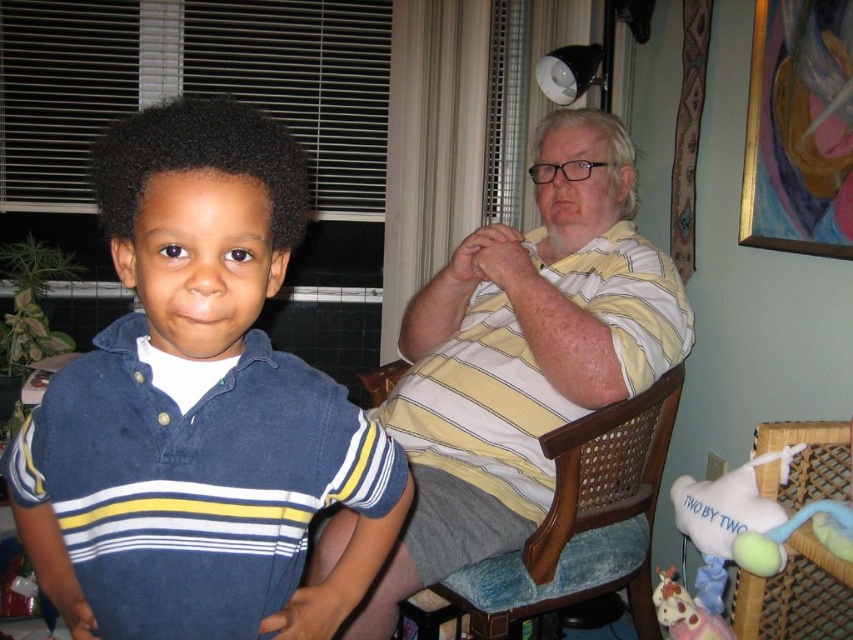
You are a photographer setting up for a family portrait. You notice the matte blue shirt at left and the white plush toy at lower right. To ensure both are clearly visible in the shot, which object should you focus on first?

The matte blue shirt at left is in front of the white plush toy at lower right, so you should focus on the matte blue shirt at left first to ensure both are in clear view.

You are standing in the room and want to determine which of the two points, point (x=602, y=467) or point (x=747, y=492), is closer to you. Based on the image, which point is nearer?

Point (x=602, y=467) is closer to you because it is further to the viewer than point (x=747, y=492).

You are a delivery person who needs to place a small package on the floor next to the woven wicker chair at lower right and the pastel plush unicorn at lower right. Which object should you place the package closer to if you want it to be near the larger item?

You should place the package closer to the woven wicker chair at lower right because it is larger than the pastel plush unicorn at lower right.